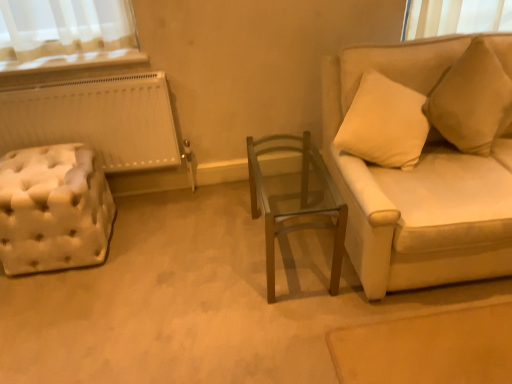
Image resolution: width=512 pixels, height=384 pixels. Identify the location of empty space that is ontop of white tufted ottoman at left. (26, 166).